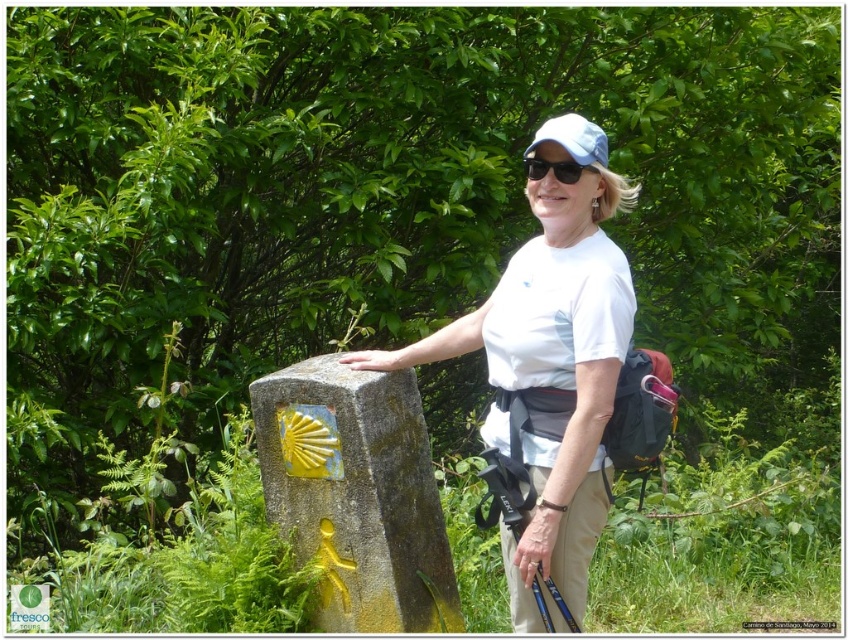
Question: Can you confirm if yellow painted stone at center is positioned below light blue fabric baseball cap at center?

Choices:
 (A) yes
 (B) no

Answer: (A)

Question: Can you confirm if light blue fabric baseball cap at center is wider than black matte sunglasses at center?

Choices:
 (A) yes
 (B) no

Answer: (A)

Question: Which of the following is the farthest from the observer?

Choices:
 (A) white cotton shirt at center
 (B) light blue fabric baseball cap at center
 (C) yellow painted stone at center

Answer: (C)

Question: Does yellow painted stone at center have a greater width compared to light blue fabric baseball cap at center?

Choices:
 (A) yes
 (B) no

Answer: (A)

Question: Which object is farther from the camera taking this photo?

Choices:
 (A) white cotton shirt at center
 (B) black matte sunglasses at center

Answer: (B)

Question: Which point is closer to the camera?

Choices:
 (A) (350, 476)
 (B) (539, 164)
 (C) (547, 128)

Answer: (B)